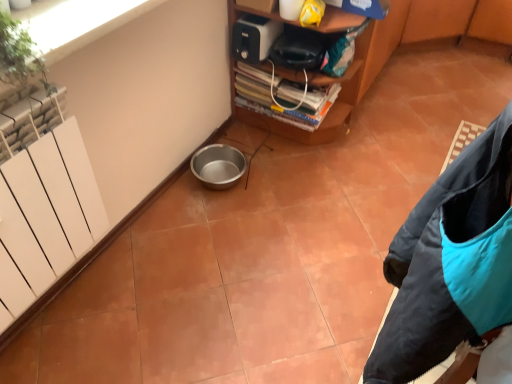
Question: Would you consider green leafy plant at upper left to be distant from teal synthetic jacket at lower right?

Choices:
 (A) yes
 (B) no

Answer: (B)

Question: Is green leafy plant at upper left closer to camera compared to teal synthetic jacket at lower right?

Choices:
 (A) yes
 (B) no

Answer: (B)

Question: Can you confirm if green leafy plant at upper left is taller than teal synthetic jacket at lower right?

Choices:
 (A) no
 (B) yes

Answer: (A)

Question: Is green leafy plant at upper left thinner than teal synthetic jacket at lower right?

Choices:
 (A) no
 (B) yes

Answer: (B)

Question: From the image's perspective, is green leafy plant at upper left over teal synthetic jacket at lower right?

Choices:
 (A) no
 (B) yes

Answer: (B)

Question: Can teal synthetic jacket at lower right be found inside green leafy plant at upper left?

Choices:
 (A) yes
 (B) no

Answer: (B)

Question: Is white plastic toaster at upper center positioned behind teal synthetic jacket at lower right?

Choices:
 (A) yes
 (B) no

Answer: (A)

Question: Considering the relative sizes of white plastic toaster at upper center and teal synthetic jacket at lower right in the image provided, is white plastic toaster at upper center taller than teal synthetic jacket at lower right?

Choices:
 (A) no
 (B) yes

Answer: (A)

Question: Is white plastic toaster at upper center at the left side of teal synthetic jacket at lower right?

Choices:
 (A) no
 (B) yes

Answer: (B)

Question: Does white plastic toaster at upper center contain teal synthetic jacket at lower right?

Choices:
 (A) yes
 (B) no

Answer: (B)

Question: Does white plastic toaster at upper center have a greater width compared to teal synthetic jacket at lower right?

Choices:
 (A) yes
 (B) no

Answer: (B)

Question: Is white plastic toaster at upper center aimed at teal synthetic jacket at lower right?

Choices:
 (A) yes
 (B) no

Answer: (B)

Question: Is teal synthetic jacket at lower right outside metallic silver bowl at lower left?

Choices:
 (A) yes
 (B) no

Answer: (A)